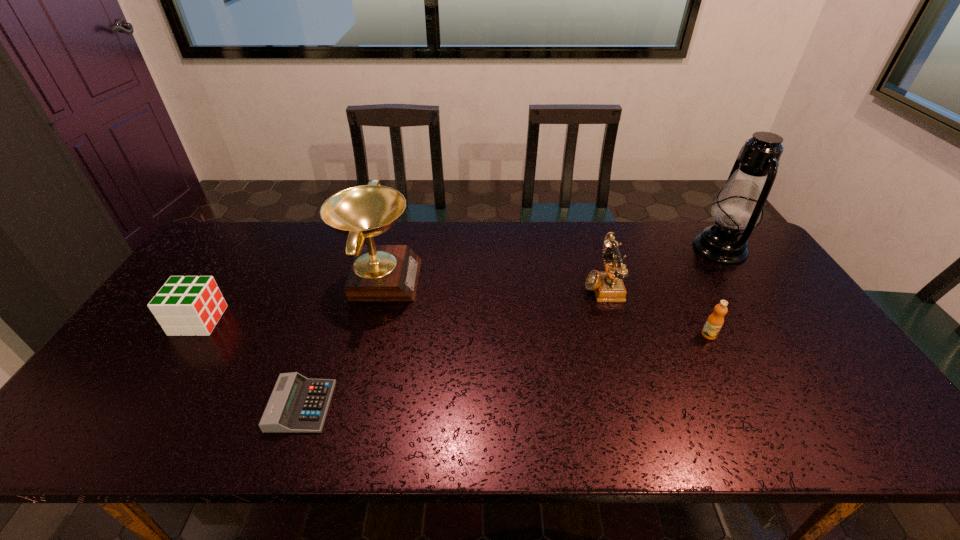
Identify the location of vacant space located on the front-facing side of the fifth shortest object. (532, 279).

You are a GUI agent. You are given a task and a screenshot of the screen. Output one action in this format:
    pyautogui.click(x=<x>, y=<y>)
    Task: Click on the blank space located 0.110m on the dial number of the fourth shortest object
    Image resolution: width=960 pixels, height=540 pixels.
    Given the screenshot: What is the action you would take?
    pyautogui.click(x=547, y=285)

The height and width of the screenshot is (540, 960). Find the location of `free space located 0.110m on the dial number of the fourth shortest object`. free space located 0.110m on the dial number of the fourth shortest object is located at coordinates (547, 285).

At what (x,y) coordinates should I click in order to perform the action: click on free space located 0.200m on the dial number of the fourth shortest object. Please return your answer as a coordinate pair (x, y). The image size is (960, 540). Looking at the image, I should click on (517, 285).

The width and height of the screenshot is (960, 540). What are the coordinates of `free spot located on the front label of the fifth object from left to right` in the screenshot? It's located at (752, 417).

Identify the location of free space located 0.390m on the red face of the leftmost object. The width and height of the screenshot is (960, 540). (360, 321).

This screenshot has height=540, width=960. Find the location of `vacant point located on the right of the shortest object`. vacant point located on the right of the shortest object is located at coordinates (372, 406).

I want to click on oil lamp that is at the far edge, so click(739, 204).

What are the coordinates of `award at the far edge` in the screenshot? It's located at (379, 273).

Locate an element on the screen. This screenshot has width=960, height=540. telephone situated at the far edge is located at coordinates (608, 286).